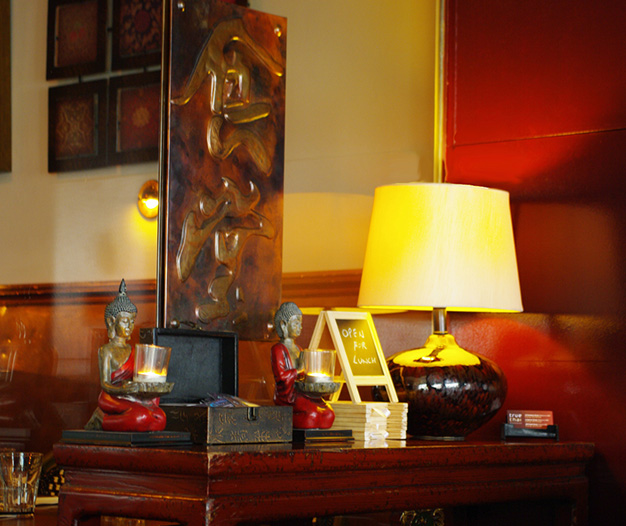
Find the location of a particular element. glass is located at coordinates (321, 364), (158, 353), (24, 480).